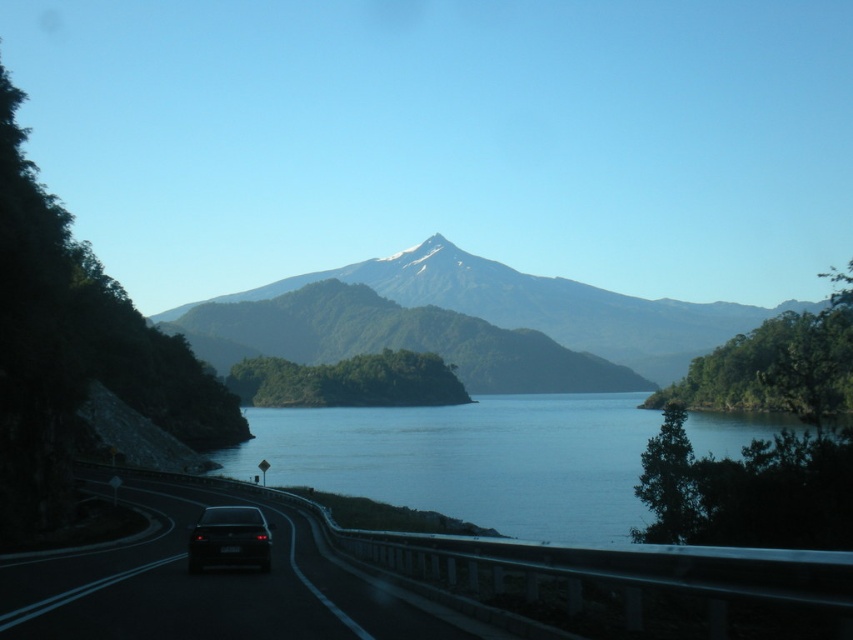
Who is positioned more to the left, black asphalt highway at lower left or green textured mountain at center?

Positioned to the left is black asphalt highway at lower left.

I want to click on black asphalt highway at lower left, so click(207, 586).

Find the location of a particular element. black asphalt highway at lower left is located at coordinates (207, 586).

Can you confirm if blue water at center is positioned to the right of black asphalt highway at lower left?

Correct, you'll find blue water at center to the right of black asphalt highway at lower left.

Does blue water at center appear under black asphalt highway at lower left?

Correct, blue water at center is located below black asphalt highway at lower left.

Locate an element on the screen. blue water at center is located at coordinates (471, 460).

Locate an element on the screen. The width and height of the screenshot is (853, 640). blue water at center is located at coordinates (471, 460).

Does blue water at center come in front of black glossy car at lower left?

Yes, blue water at center is in front of black glossy car at lower left.

Which is behind, point (357, 419) or point (227, 548)?

The point (357, 419) is more distant.

The width and height of the screenshot is (853, 640). In order to click on blue water at center in this screenshot , I will do `click(471, 460)`.